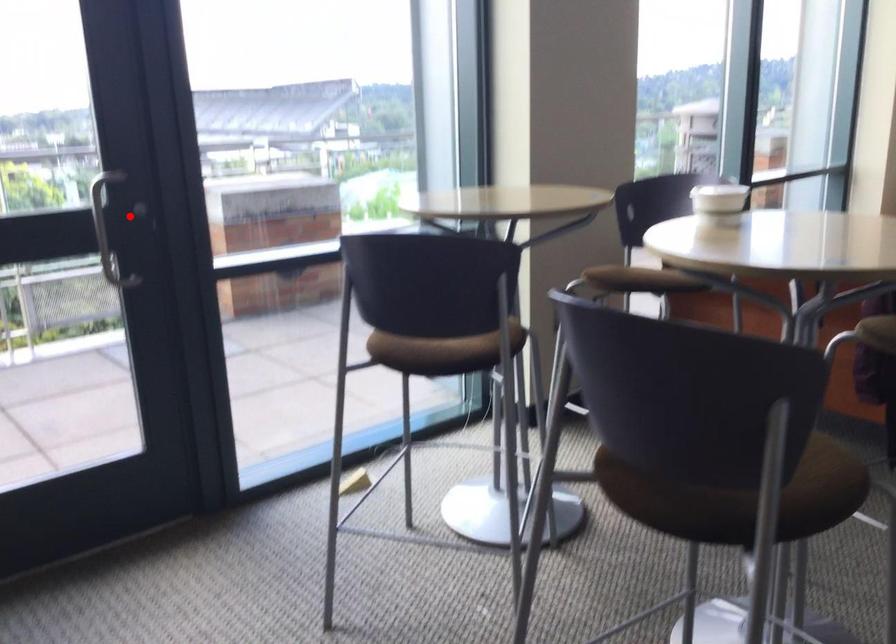
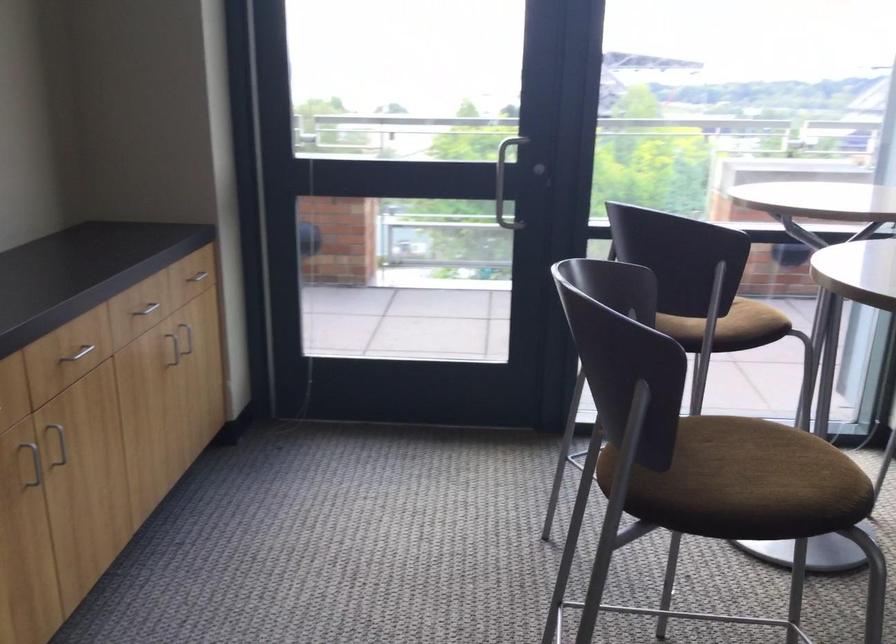
Locate, in the second image, the point that corresponds to the highlighted location in the first image.

(503, 173)